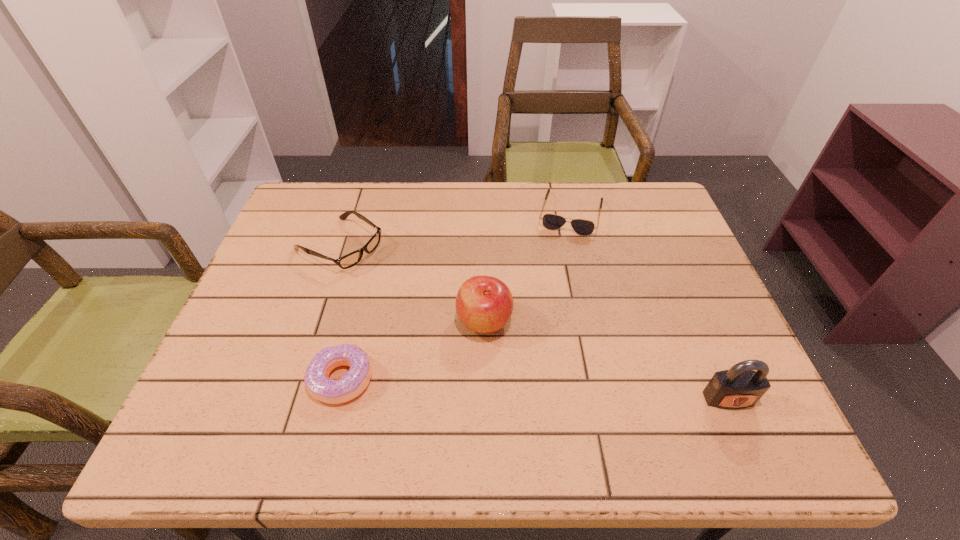
Locate an element on the screen. empty space between the spectacles and the apple is located at coordinates (412, 284).

Identify the location of unoccupied position between the third nearest object and the rightmost object. (606, 360).

Identify the location of blank region between the third object from left to right and the spectacles. This screenshot has width=960, height=540. (412, 284).

The height and width of the screenshot is (540, 960). What are the coordinates of `empty space between the spectacles and the rightmost object` in the screenshot? It's located at (534, 322).

You are a GUI agent. You are given a task and a screenshot of the screen. Output one action in this format:
    pyautogui.click(x=<x>, y=<y>)
    Task: Click on the free space between the second object from right to left and the padlock
    Image resolution: width=960 pixels, height=540 pixels.
    Given the screenshot: What is the action you would take?
    pyautogui.click(x=650, y=306)

Identify the location of vacant area that lies between the spectacles and the sunglasses. (455, 230).

You are a GUI agent. You are given a task and a screenshot of the screen. Output one action in this format:
    pyautogui.click(x=<x>, y=<y>)
    Task: Click on the unoccupied position between the rightmost object and the doughnut
    
    Given the screenshot: What is the action you would take?
    pyautogui.click(x=535, y=389)

You are a GUI agent. You are given a task and a screenshot of the screen. Output one action in this format:
    pyautogui.click(x=<x>, y=<y>)
    Task: Click on the closest object to the fourth object from left to right
    The image size is (960, 540).
    Given the screenshot: What is the action you would take?
    tap(484, 304)

Identify which object is the fourth nearest to the spectacles. Please provide its 2D coordinates. Your answer should be formatted as a tuple, i.e. [(x, y)], where the tuple contains the x and y coordinates of a point satisfying the conditions above.

[(740, 387)]

Locate an element on the screen. vacant point that satisfies the following two spatial constraints: 1. on the back side of the spectacles; 2. on the left side of the sunglasses is located at coordinates (350, 213).